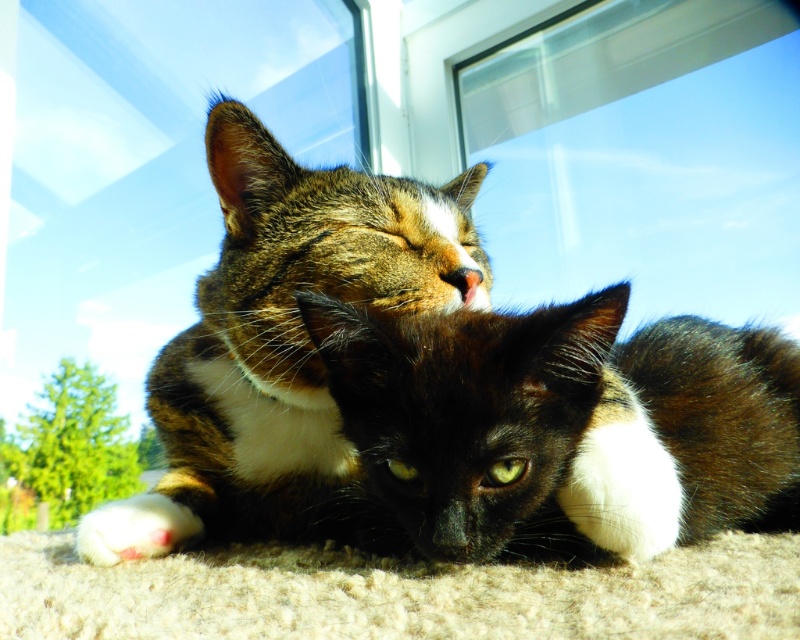
Can you confirm if calico fur cat at center is positioned below black fur cat at center?

No.

Does point (626, 429) come in front of point (784, 449)?

Yes, point (626, 429) is closer to viewer.

Who is more distant from viewer, (210, 454) or (449, 330)?

Point (210, 454)

This screenshot has width=800, height=640. Identify the location of calico fur cat at center. (462, 394).

Which is in front, point (244, 248) or point (84, 205)?

Positioned in front is point (244, 248).

How far apart are calico fur cat at center and transparent glass door at upper center?

calico fur cat at center is 3.83 feet away from transparent glass door at upper center.

What are the coordinates of `calico fur cat at center` in the screenshot? It's located at (462, 394).

You are a GUI agent. You are given a task and a screenshot of the screen. Output one action in this format:
    pyautogui.click(x=<x>, y=<y>)
    Task: Click on the calico fur cat at center
    
    Given the screenshot: What is the action you would take?
    pyautogui.click(x=462, y=394)

Is transparent glass door at upper center thinner than white fluffy paw at lower left?

No, transparent glass door at upper center is not thinner than white fluffy paw at lower left.

This screenshot has width=800, height=640. I want to click on transparent glass door at upper center, so click(x=132, y=209).

Locate an element on the screen. transparent glass door at upper center is located at coordinates (132, 209).